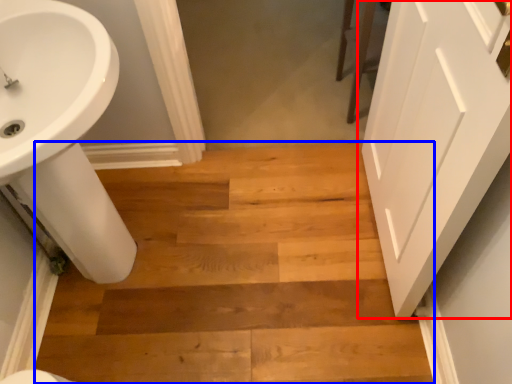
Question: Which of the following is the closest to the observer, door (highlighted by a red box) or stairwell (highlighted by a blue box)?

Choices:
 (A) door
 (B) stairwell

Answer: (A)